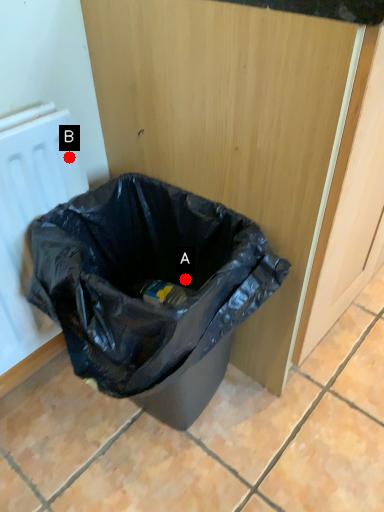
Question: Two points are circled on the image, labeled by A and B beside each circle. Among these points, which one is nearest to the camera?

Choices:
 (A) A is closer
 (B) B is closer

Answer: (B)